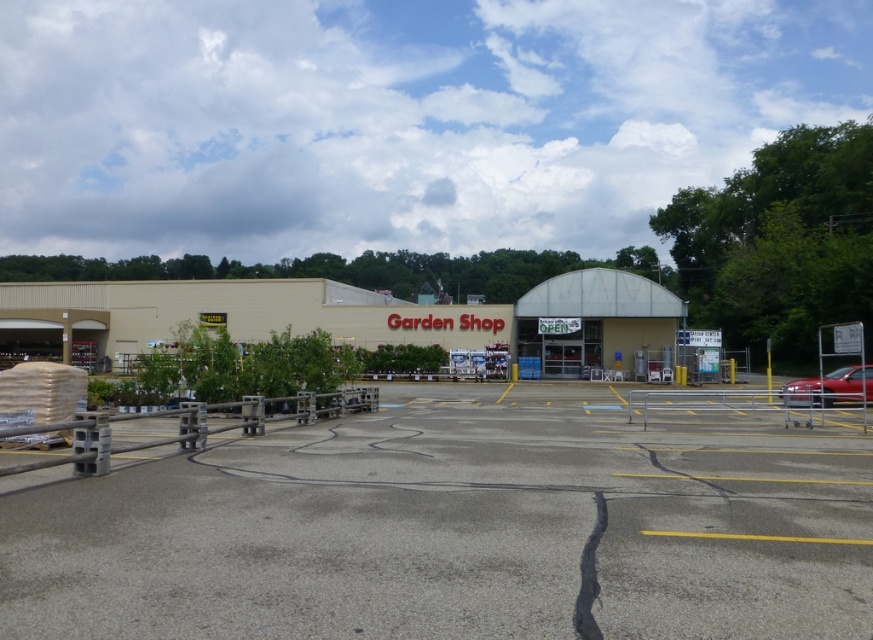
Question: Does beige/textured building at center appear on the left side of metallic silver awning at center?

Choices:
 (A) yes
 (B) no

Answer: (A)

Question: Which point appears closest to the camera in this image?

Choices:
 (A) (582, 269)
 (B) (225, 550)

Answer: (B)

Question: Is beige/textured building at center thinner than shiny red sedan at right?

Choices:
 (A) no
 (B) yes

Answer: (A)

Question: Observing the image, what is the correct spatial positioning of gray concrete parking lot at lower left in reference to metallic silver awning at center?

Choices:
 (A) above
 (B) below

Answer: (B)

Question: Which point is closer to the camera?

Choices:
 (A) gray concrete parking lot at lower left
 (B) metallic silver awning at center
 (C) beige/textured building at center
 (D) shiny red sedan at right

Answer: (A)

Question: Which is farther from the shiny red sedan at right?

Choices:
 (A) gray concrete parking lot at lower left
 (B) beige/textured building at center

Answer: (B)